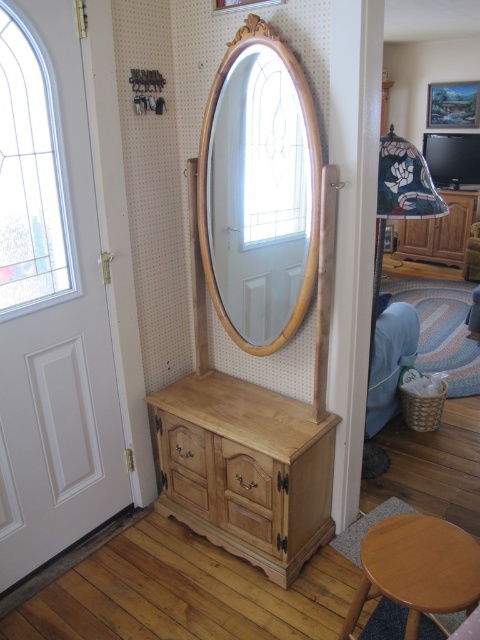
Is natural wood dresser at center smaller than light brown wooden stool at lower right?

Actually, natural wood dresser at center might be larger than light brown wooden stool at lower right.

Between natural wood dresser at center and light brown wooden stool at lower right, which one is positioned higher?

natural wood dresser at center is above.

Which is in front, point (216, 416) or point (470, 547)?

Positioned in front is point (470, 547).

At what (x,y) coordinates should I click in order to perform the action: click on natural wood dresser at center. Please return your answer as a coordinate pair (x, y). The height and width of the screenshot is (640, 480). Looking at the image, I should click on (245, 468).

Between light brown wooden stool at lower right and wooden cabinet at right, which one appears on the right side from the viewer's perspective?

From the viewer's perspective, wooden cabinet at right appears more on the right side.

Who is positioned more to the left, light brown wooden stool at lower right or wooden cabinet at right?

Positioned to the left is light brown wooden stool at lower right.

Between point (435, 611) and point (458, 195), which one is positioned behind?

The point (458, 195) is behind.

Where is `light brown wooden stool at lower right`? This screenshot has height=640, width=480. light brown wooden stool at lower right is located at coordinates (417, 568).

Can you confirm if wooden mirror at center is positioned above light brown wooden stool at lower right?

Yes, wooden mirror at center is above light brown wooden stool at lower right.

Between point (256, 324) and point (416, 556), which one is positioned in front?

Positioned in front is point (416, 556).

Identify the location of wooden mirror at center. (260, 193).

This screenshot has height=640, width=480. Identify the location of wooden mirror at center. (260, 193).